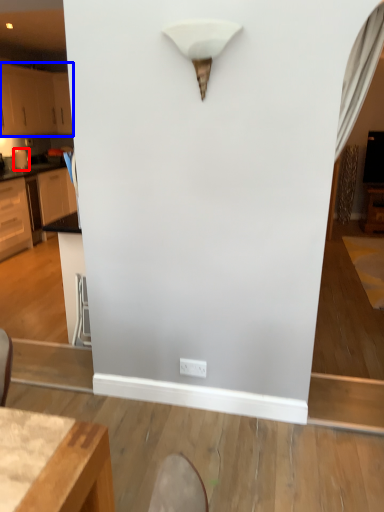
Question: Which object appears closest to the camera in this image, appliance (highlighted by a red box) or cabinetry (highlighted by a blue box)?

Choices:
 (A) appliance
 (B) cabinetry

Answer: (B)